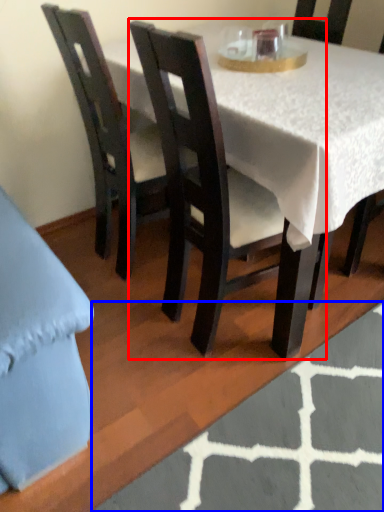
Question: Which point is closer to the camera, chair (highlighted by a red box) or place mat (highlighted by a blue box)?

Choices:
 (A) chair
 (B) place mat

Answer: (A)